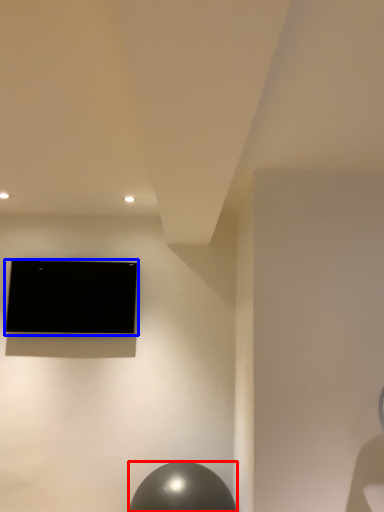
Question: Which of the following is the closest to the observer, ball (highlighted by a red box) or television (highlighted by a blue box)?

Choices:
 (A) ball
 (B) television

Answer: (A)